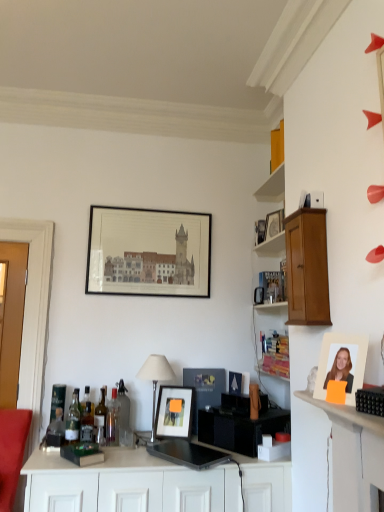
Question: Is translucent glass bottle at center, the fourth bottle from the left, not close to matte black picture frame at center, marked as the second picture frame in a bottom-to-top arrangement?

Choices:
 (A) no
 (B) yes

Answer: (A)

Question: Is translucent glass bottle at center, marked as the 4th bottle in a right-to-left arrangement, behind matte black picture frame at center, marked as the second picture frame in a bottom-to-top arrangement?

Choices:
 (A) no
 (B) yes

Answer: (A)

Question: Is translucent glass bottle at center, the fourth bottle from the left, shorter than matte black picture frame at center, the 3th picture frame from the back?

Choices:
 (A) yes
 (B) no

Answer: (B)

Question: From a real-world perspective, is translucent glass bottle at center, marked as the 4th bottle in a right-to-left arrangement, beneath matte black picture frame at center, which is counted as the third picture frame, starting from the left?

Choices:
 (A) yes
 (B) no

Answer: (A)

Question: From a real-world perspective, is translucent glass bottle at center, the fourth bottle from the left, positioned over matte black picture frame at center, acting as the second picture frame starting from the right, based on gravity?

Choices:
 (A) yes
 (B) no

Answer: (B)

Question: Considering the positions of translucent glass bottle at center, the 2th bottle when ordered from right to left, and clear glass bottle at center, arranged as the 1th bottle when viewed from the right, in the image, is translucent glass bottle at center, the 2th bottle when ordered from right to left, bigger or smaller than clear glass bottle at center, arranged as the 1th bottle when viewed from the right,?

Choices:
 (A) big
 (B) small

Answer: (B)

Question: Considering the positions of translucent glass bottle at center, marked as the 6th bottle in a left-to-right arrangement, and clear glass bottle at center, the 7th bottle in the left-to-right sequence, in the image, is translucent glass bottle at center, marked as the 6th bottle in a left-to-right arrangement, taller or shorter than clear glass bottle at center, the 7th bottle in the left-to-right sequence,?

Choices:
 (A) tall
 (B) short

Answer: (B)

Question: Is translucent glass bottle at center, the 2th bottle when ordered from right to left, inside or outside of clear glass bottle at center, arranged as the 1th bottle when viewed from the right?

Choices:
 (A) outside
 (B) inside

Answer: (A)

Question: In the image, is translucent glass bottle at center, the 2th bottle when ordered from right to left, positioned in front of or behind clear glass bottle at center, arranged as the 1th bottle when viewed from the right?

Choices:
 (A) front
 (B) behind

Answer: (A)

Question: From a real-world perspective, is matte black picture frame at center, the 2th picture frame viewed from the left, physically located above or below translucent glass bottle at center left, which is the fifth bottle from right to left?

Choices:
 (A) above
 (B) below

Answer: (A)

Question: From the image's perspective, relative to translucent glass bottle at center left, which is the third bottle in left-to-right order, is matte black picture frame at center, the 2th picture frame viewed from the left, above or below?

Choices:
 (A) below
 (B) above

Answer: (A)

Question: Considering their positions, is matte black picture frame at center, the third picture frame from the front, located in front of or behind translucent glass bottle at center left, which is the third bottle in left-to-right order?

Choices:
 (A) front
 (B) behind

Answer: (B)

Question: Looking at the image, does matte black picture frame at center, which is counted as the 4th picture frame, starting from the top, seem bigger or smaller compared to translucent glass bottle at center left, which is the third bottle in left-to-right order?

Choices:
 (A) small
 (B) big

Answer: (B)

Question: In the image, is wooden cabinet at upper right on the left side or the right side of light brown wood cabinet at upper right?

Choices:
 (A) right
 (B) left

Answer: (A)

Question: In terms of size, does wooden cabinet at upper right appear bigger or smaller than light brown wood cabinet at upper right?

Choices:
 (A) small
 (B) big

Answer: (A)